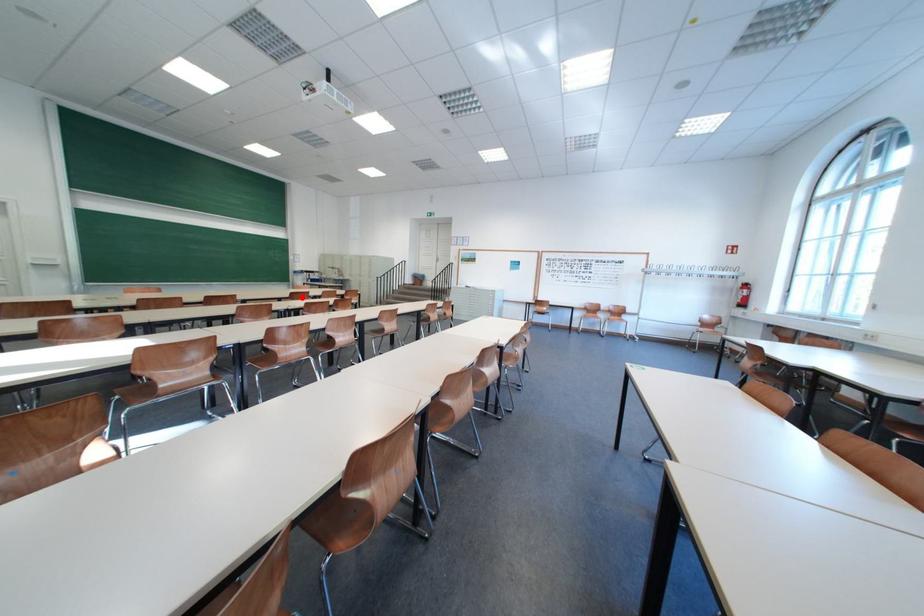
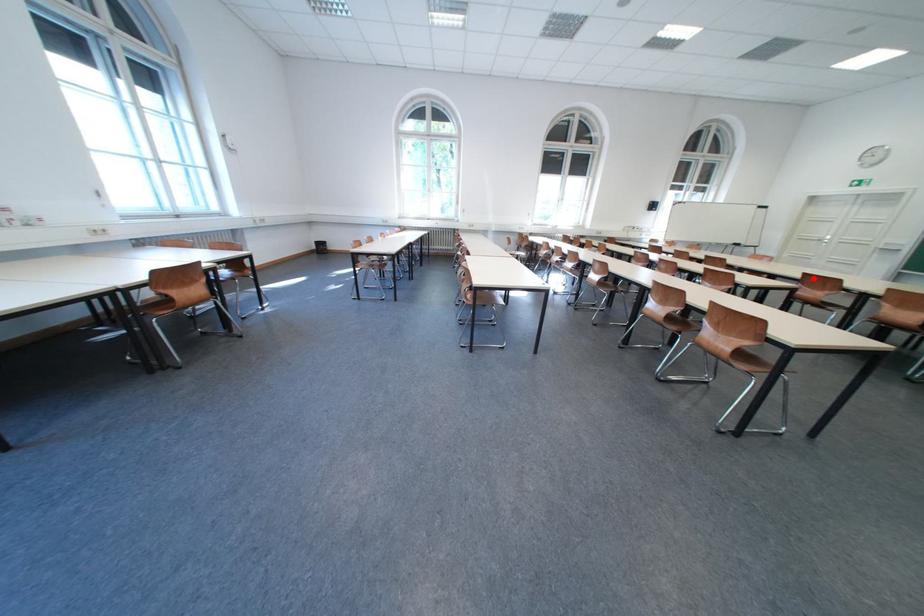
I am providing you with two images of the same scene from different viewpoints. A red point is marked on the first image and another point is marked on the second image. Is the marked point in image1 the same physical position as the marked point in image2?

Yes